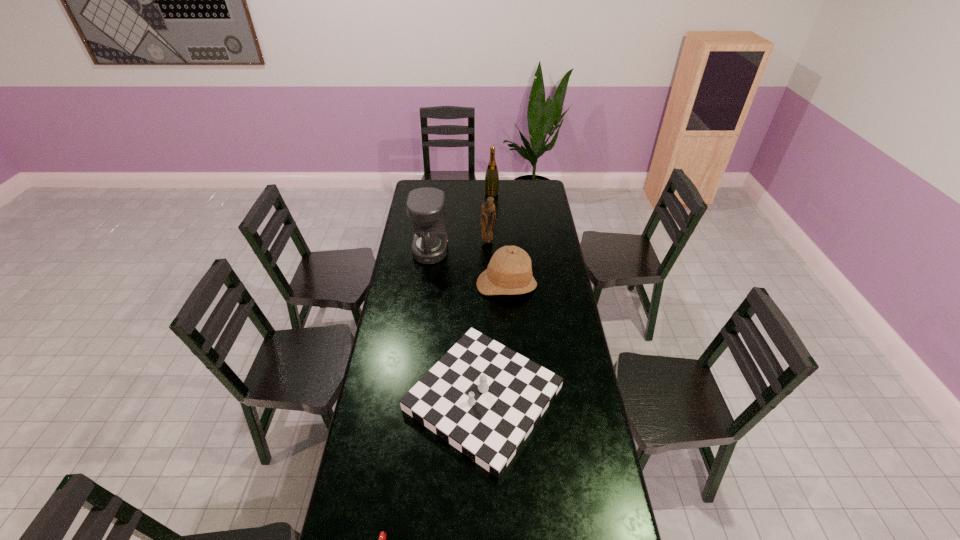
Identify the location of blank area located on the front-facing side of the hat. (509, 311).

At what (x,y) coordinates should I click in order to perform the action: click on vacant region located 0.080m on the left of the fifth tallest object. Please return your answer as a coordinate pair (x, y). Looking at the image, I should click on (382, 398).

Locate an element on the screen. This screenshot has height=540, width=960. object at the far edge is located at coordinates (492, 176).

Locate an element on the screen. The height and width of the screenshot is (540, 960). coffee maker located in the left edge section of the desktop is located at coordinates (425, 206).

The height and width of the screenshot is (540, 960). In order to click on checkerboard situated at the left edge in this screenshot , I will do `click(483, 398)`.

What are the coordinates of `hat located in the right edge section of the desktop` in the screenshot? It's located at (509, 272).

This screenshot has width=960, height=540. I want to click on checkerboard located in the right edge section of the desktop, so click(x=483, y=398).

Find the location of a particular element. Image resolution: width=960 pixels, height=540 pixels. vacant space at the left edge is located at coordinates (409, 220).

Where is `vacant space at the right edge of the desktop`? This screenshot has height=540, width=960. vacant space at the right edge of the desktop is located at coordinates (562, 342).

In the image, there is a desktop. Where is `vacant space at the far left corner`? This screenshot has height=540, width=960. vacant space at the far left corner is located at coordinates (422, 186).